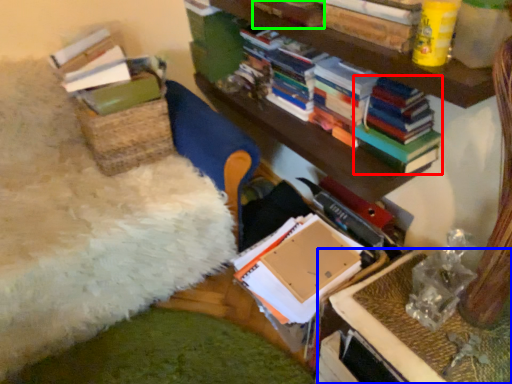
Question: Which is farther away from magazine (highlighted by a red box)? table (highlighted by a blue box) or book (highlighted by a green box)?

Choices:
 (A) table
 (B) book

Answer: (A)